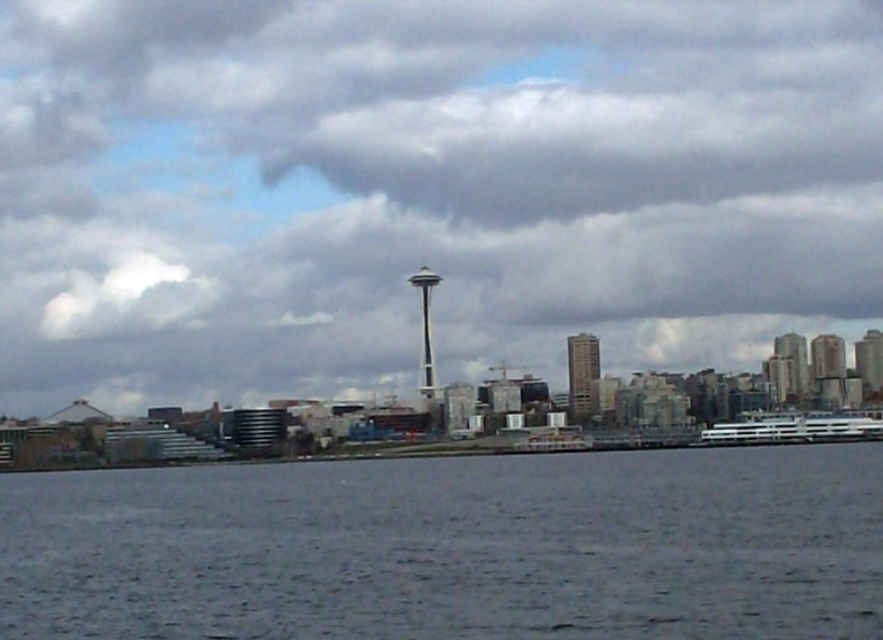
You are standing at a viewpoint overlooking the city and the Space Needle. You notice two points marked on the landscape. The first point is located at coordinates point [824,100], and the second is at point [149,620]. Which of these two points is closer to your current position?

Point [824,100] is further to the viewer than point [149,620], so the point closer to your current position is point [149,620].

You are a photographer planning to capture a wide shot of the cloudy sky at center and the white glossy ferry at right. Your camera has a maximum focus range of 120 meters. Will you be able to capture both objects in focus simultaneously?

The cloudy sky at center and white glossy ferry at right are 123.89 meters apart from each other. Since the distance exceeds the camera maximum focus range of 120 meters, you cannot capture both objects in focus simultaneously.

You are a photographer standing at the waterfront. You want to capture a photo that includes both the gray matte water at lower center and the white glossy ferry at right. Based on their positions, which object should appear closer to the camera in the photo?

The gray matte water at lower center appears closer to the camera because it is positioned in front of the white glossy ferry at right.